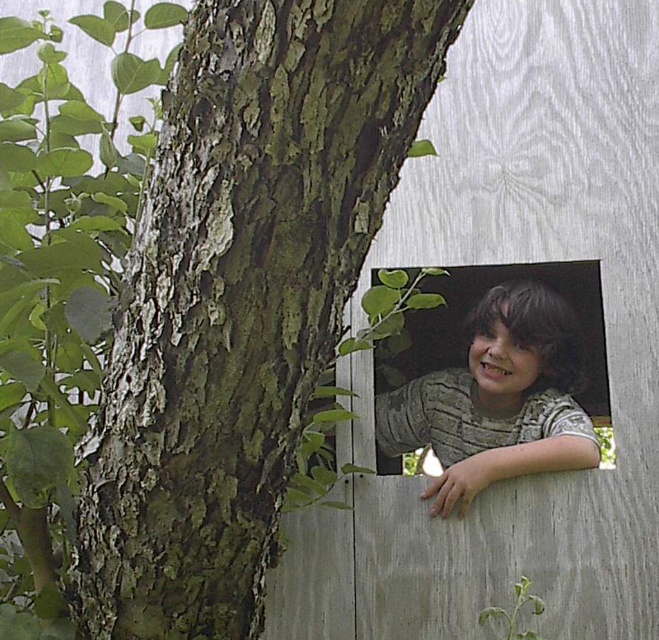
You are a child trying to reach a greenish brown bark at center. The bark is located at point (241, 296). You are standing at point 0.5, 0.5. Can you reach it without moving your feet?

The greenish brown bark at center is located at point (241, 296), which is very close to your current position at 0.5, 0.5. Since the distance between the two points is minimal, you can likely reach it without moving your feet.